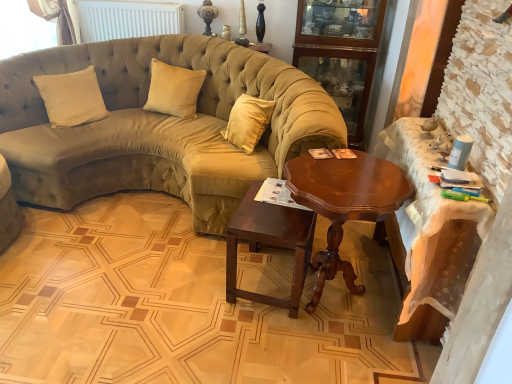
Image resolution: width=512 pixels, height=384 pixels. I want to click on free spot in front of mahogany wood side table at center, marked as the 1th table in a left-to-right arrangement, so click(257, 346).